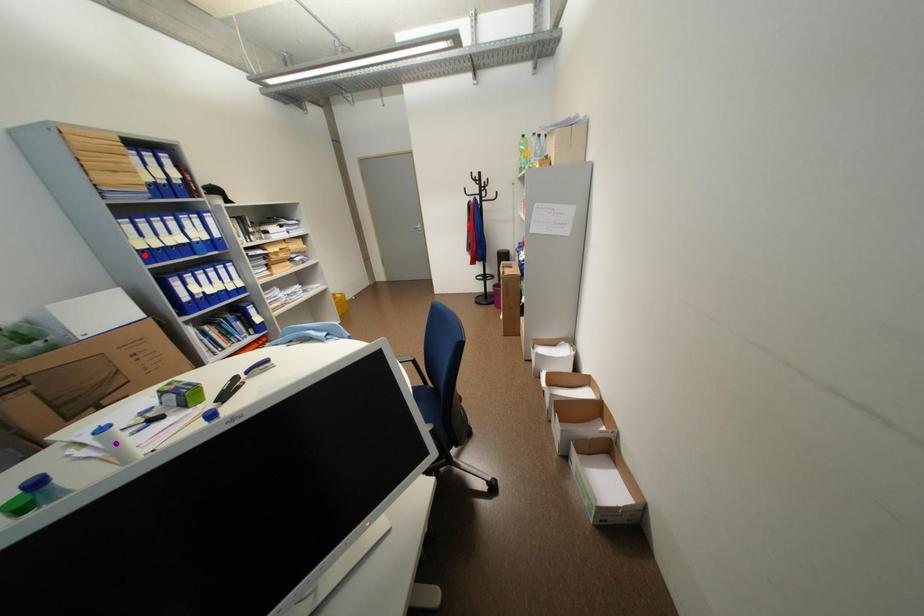
Order these from nearest to farthest:
red point
orange point
purple point

purple point
red point
orange point